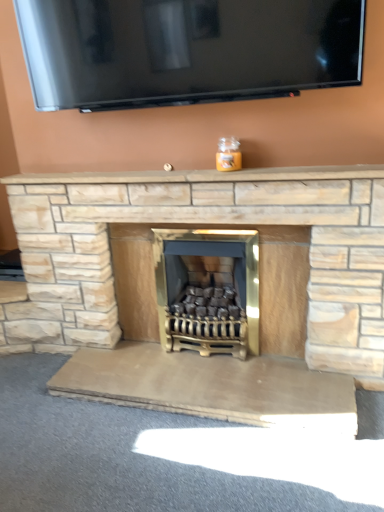
Question: Does beige stone mantle at center have a smaller size compared to gold metallic wood burning stove at center?

Choices:
 (A) yes
 (B) no

Answer: (A)

Question: Is beige stone mantle at center next to gold metallic wood burning stove at center and touching it?

Choices:
 (A) yes
 (B) no

Answer: (B)

Question: Considering the relative sizes of beige stone mantle at center and gold metallic wood burning stove at center in the image provided, is beige stone mantle at center wider than gold metallic wood burning stove at center?

Choices:
 (A) no
 (B) yes

Answer: (A)

Question: From a real-world perspective, is beige stone mantle at center on gold metallic wood burning stove at center?

Choices:
 (A) no
 (B) yes

Answer: (B)

Question: From the image's perspective, is beige stone mantle at center over gold metallic wood burning stove at center?

Choices:
 (A) yes
 (B) no

Answer: (A)

Question: Is beige stone mantle at center positioned behind gold metallic wood burning stove at center?

Choices:
 (A) yes
 (B) no

Answer: (B)

Question: From the image's perspective, would you say natural stone fireplace at center is positioned over gold metallic wood burning stove at center?

Choices:
 (A) no
 (B) yes

Answer: (B)

Question: Would you consider natural stone fireplace at center to be distant from gold metallic wood burning stove at center?

Choices:
 (A) yes
 (B) no

Answer: (B)

Question: From a real-world perspective, is natural stone fireplace at center located beneath gold metallic wood burning stove at center?

Choices:
 (A) yes
 (B) no

Answer: (B)

Question: Is natural stone fireplace at center aimed at gold metallic wood burning stove at center?

Choices:
 (A) yes
 (B) no

Answer: (A)

Question: Can you confirm if natural stone fireplace at center is taller than gold metallic wood burning stove at center?

Choices:
 (A) no
 (B) yes

Answer: (B)

Question: Is natural stone fireplace at center thinner than gold metallic wood burning stove at center?

Choices:
 (A) no
 (B) yes

Answer: (B)

Question: From the image's perspective, is gold metallic wood burning stove at center below beige stone mantle at center?

Choices:
 (A) no
 (B) yes

Answer: (B)